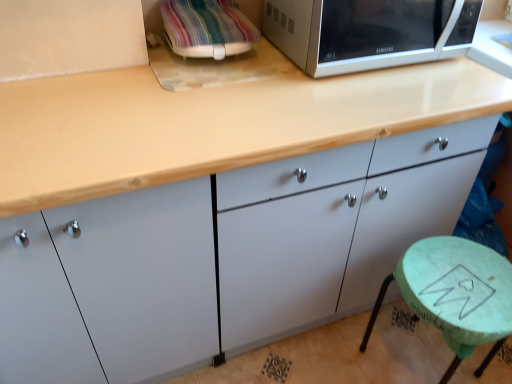
Locate an element on the screen. The width and height of the screenshot is (512, 384). free location in front of satin silver microwave at upper right is located at coordinates (358, 104).